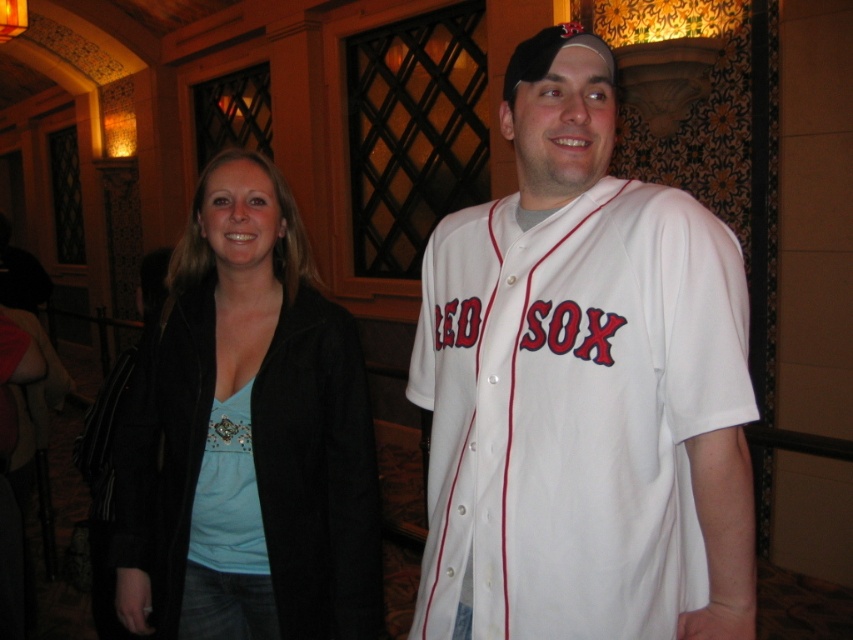
Is white jersey at center to the right of matte black jacket at center from the viewer's perspective?

Indeed, white jersey at center is positioned on the right side of matte black jacket at center.

From the picture: Can you confirm if white jersey at center is bigger than matte black jacket at center?

No, white jersey at center is not bigger than matte black jacket at center.

Which is behind, point (584, 227) or point (184, 588)?

The point (184, 588) is behind.

Find the location of a particular element. The width and height of the screenshot is (853, 640). white jersey at center is located at coordinates point(582,388).